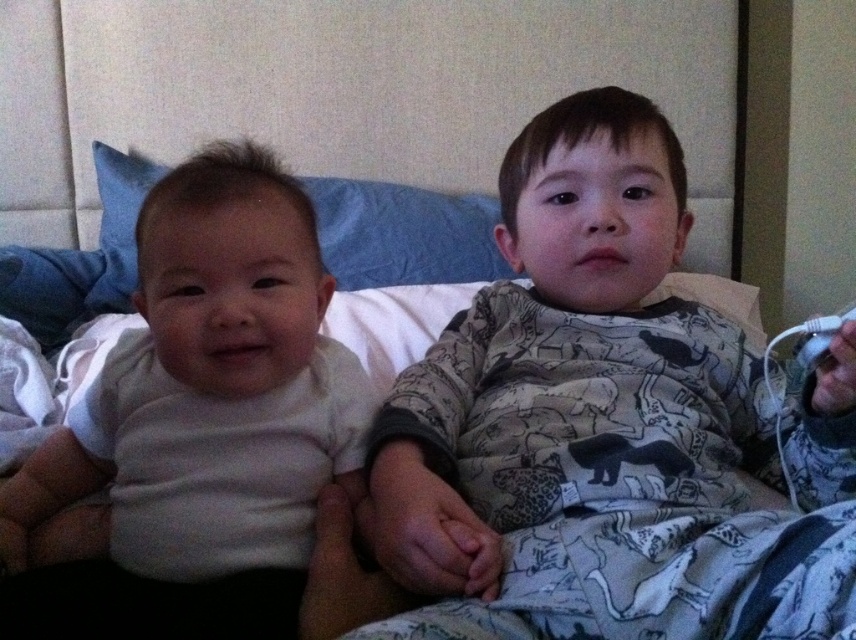
Is printed cotton pajamas at center wider than blue fabric pillow at upper left?

Yes, printed cotton pajamas at center is wider than blue fabric pillow at upper left.

Between printed cotton pajamas at center and blue fabric pillow at upper left, which one appears on the right side from the viewer's perspective?

printed cotton pajamas at center is more to the right.

What do you see at coordinates (607, 428) in the screenshot? I see `printed cotton pajamas at center` at bounding box center [607, 428].

Image resolution: width=856 pixels, height=640 pixels. I want to click on printed cotton pajamas at center, so click(x=607, y=428).

Which is behind, point (761, 582) or point (165, 572)?

Positioned behind is point (165, 572).

Can you confirm if printed cotton pajamas at center is positioned to the right of white matte shirt at left?

Indeed, printed cotton pajamas at center is positioned on the right side of white matte shirt at left.

Who is more forward, (453, 380) or (205, 509)?

Point (205, 509) is more forward.

At what (x,y) coordinates should I click in order to perform the action: click on printed cotton pajamas at center. Please return your answer as a coordinate pair (x, y). This screenshot has width=856, height=640. Looking at the image, I should click on (607, 428).

Can you confirm if white matte shirt at left is positioned to the right of blue fabric pillow at upper left?

Incorrect, white matte shirt at left is not on the right side of blue fabric pillow at upper left.

Can you confirm if white matte shirt at left is positioned above blue fabric pillow at upper left?

Actually, white matte shirt at left is below blue fabric pillow at upper left.

The image size is (856, 640). What do you see at coordinates (197, 424) in the screenshot?
I see `white matte shirt at left` at bounding box center [197, 424].

Where is `white matte shirt at left`? The height and width of the screenshot is (640, 856). white matte shirt at left is located at coordinates point(197,424).